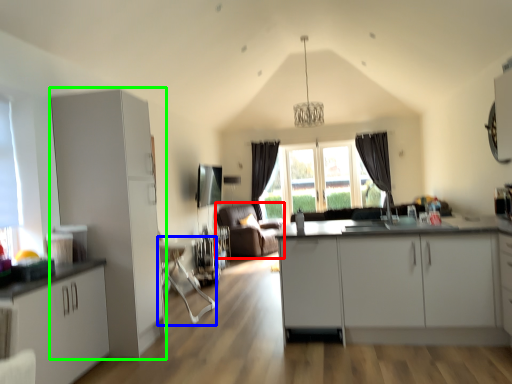
Question: Based on their relative distances, which object is farther from couch (highlighted by a red box)? Choose from swivel chair (highlighted by a blue box) and cabinetry (highlighted by a green box).

Choices:
 (A) swivel chair
 (B) cabinetry

Answer: (B)